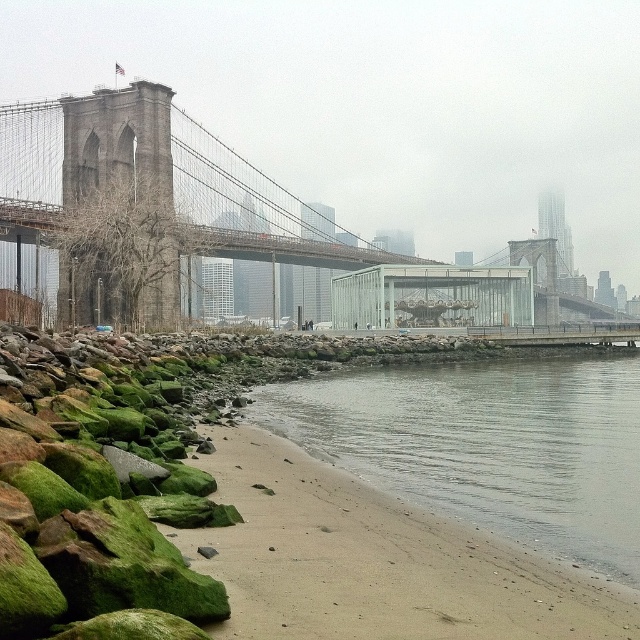
Question: Is gray smooth water at lower center bigger than brown stone suspension bridge at center?

Choices:
 (A) yes
 (B) no

Answer: (B)

Question: Which point appears closest to the camera in this image?

Choices:
 (A) (596, 369)
 (B) (16, 212)

Answer: (A)

Question: Which of the following is the farthest from the observer?

Choices:
 (A) gray smooth water at lower center
 (B) brown stone suspension bridge at center

Answer: (B)

Question: Does gray smooth water at lower center appear on the left side of brown stone suspension bridge at center?

Choices:
 (A) yes
 (B) no

Answer: (B)

Question: Is gray smooth water at lower center smaller than brown stone suspension bridge at center?

Choices:
 (A) no
 (B) yes

Answer: (B)